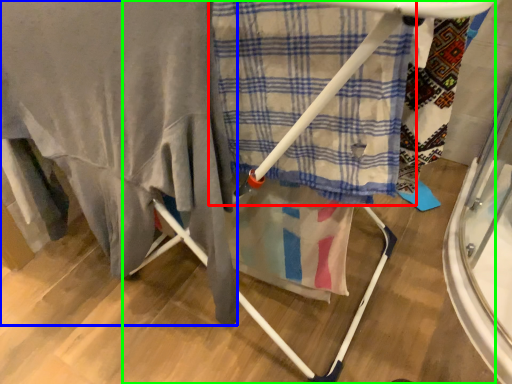
Question: Based on their relative distances, which object is farther from cloth (highlighted by a red box)? Choose from blanket (highlighted by a blue box) and furniture (highlighted by a green box).

Choices:
 (A) blanket
 (B) furniture

Answer: (A)